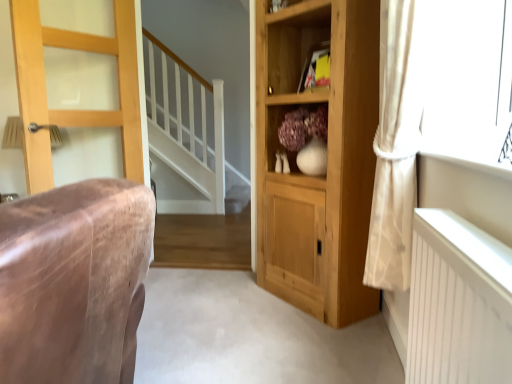
Question: In the image, is light brown wooden door at left on the left side or the right side of white sheer curtain at right?

Choices:
 (A) right
 (B) left

Answer: (B)

Question: Considering the positions of point (139, 49) and point (397, 114), is point (139, 49) closer or farther from the camera than point (397, 114)?

Choices:
 (A) farther
 (B) closer

Answer: (A)

Question: Based on their relative distances, which object is nearer to the natural wood cupboard at center?

Choices:
 (A) white sheer curtain at right
 (B) light brown wooden door at left
 (C) yellow paper at upper center
 (D) wooden cabinet at center

Answer: (D)

Question: Estimate the real-world distances between objects in this image. Which object is closer to the white sheer curtain at right?

Choices:
 (A) natural wood cupboard at center
 (B) wooden cabinet at center
 (C) yellow paper at upper center
 (D) light brown wooden door at left

Answer: (A)